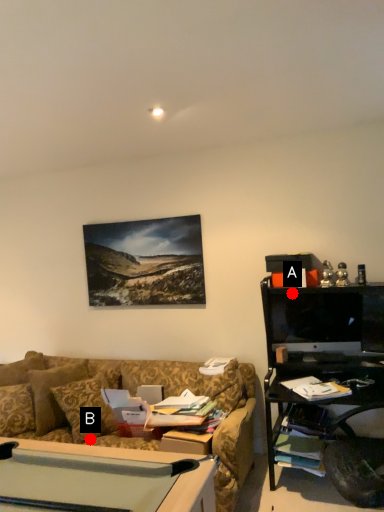
Question: Two points are circled on the image, labeled by A and B beside each circle. Which of the following is the farthest from the observer?

Choices:
 (A) A is further
 (B) B is further

Answer: (A)